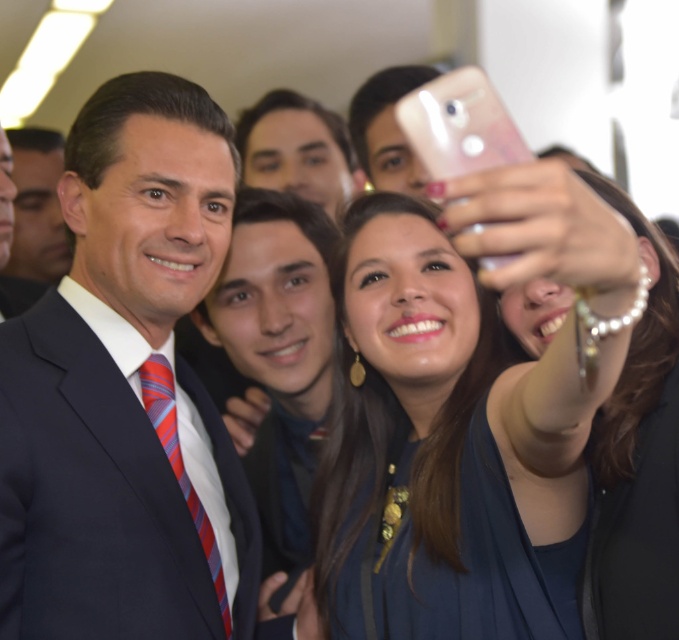
Does matte black suit at center have a smaller size compared to blue fabric dress at center?

Indeed, matte black suit at center has a smaller size compared to blue fabric dress at center.

Between matte black suit at center and blue fabric dress at center, which one appears on the left side from the viewer's perspective?

Positioned to the left is matte black suit at center.

I want to click on matte black suit at center, so click(x=124, y=388).

Image resolution: width=679 pixels, height=640 pixels. Find the location of `matte black suit at center`. matte black suit at center is located at coordinates (124, 388).